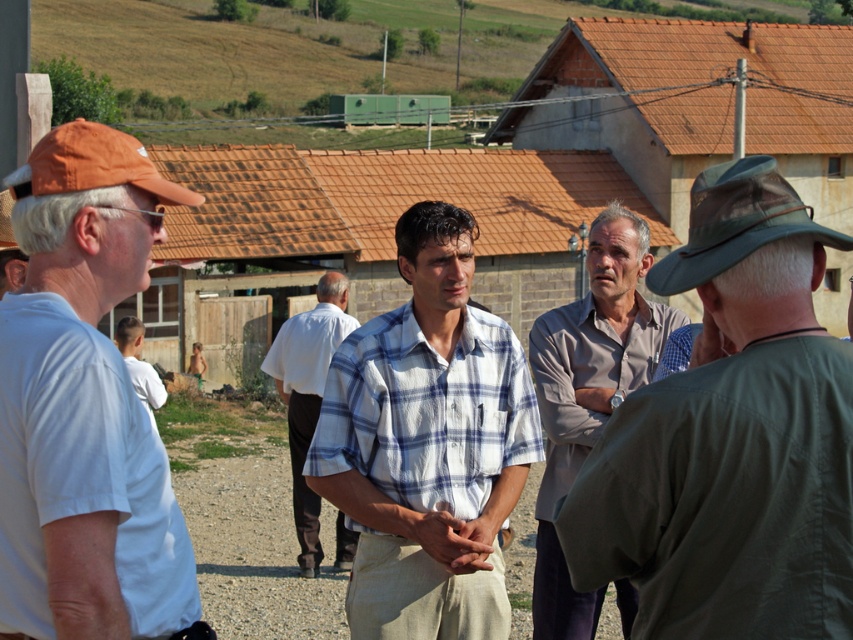
Based on the photo, which is more to the left, white checkered shirt at center or white shirt at lower left?

Positioned to the left is white shirt at lower left.

Which is behind, point (440, 609) or point (146, 396)?

Point (146, 396)

In order to click on white checkered shirt at center in this screenshot , I will do `click(427, 444)`.

Does point (469, 621) come farther from viewer compared to point (303, 444)?

No, it is not.

Can you confirm if white checkered shirt at center is bigger than white cotton shirt at center?

Yes, white checkered shirt at center is bigger than white cotton shirt at center.

Who is more forward, (341, 422) or (303, 390)?

Point (341, 422) is more forward.

The width and height of the screenshot is (853, 640). Find the location of `white checkered shirt at center`. white checkered shirt at center is located at coordinates (427, 444).

Can you confirm if gray cotton shirt at center is thinner than white cotton shirt at center?

In fact, gray cotton shirt at center might be wider than white cotton shirt at center.

Is point (627, 244) farther from viewer compared to point (306, 566)?

No, (627, 244) is closer to viewer.

Find the location of a particular element. Image resolution: width=853 pixels, height=640 pixels. gray cotton shirt at center is located at coordinates (589, 394).